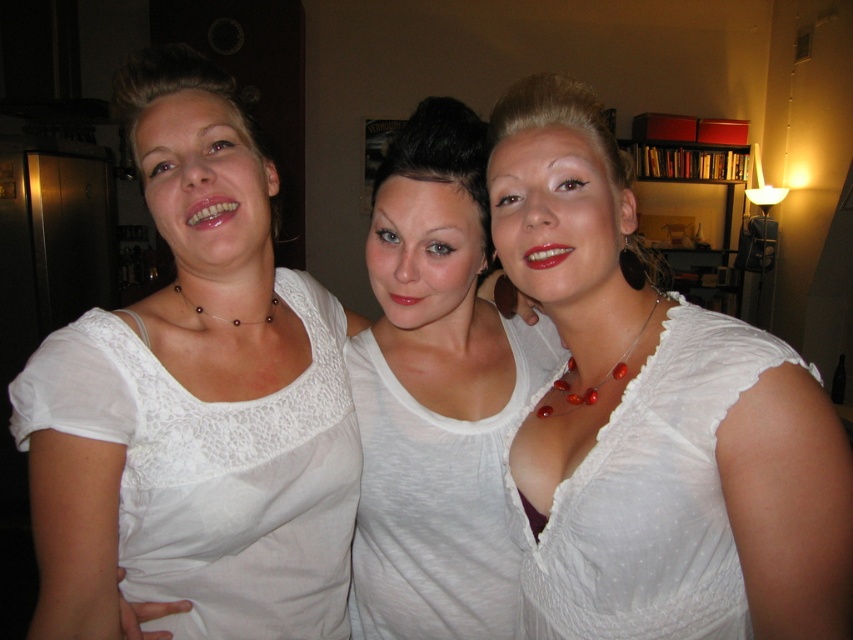
Question: Is white lace top at center positioned behind white sheer dress at center?

Choices:
 (A) yes
 (B) no

Answer: (A)

Question: Which object appears closest to the camera in this image?

Choices:
 (A) white sheer dress at center
 (B) white lace top at center
 (C) white lace blouse at left

Answer: (A)

Question: Is white lace blouse at left to the left of white sheer dress at center from the viewer's perspective?

Choices:
 (A) yes
 (B) no

Answer: (A)

Question: Which point is closer to the camera taking this photo?

Choices:
 (A) (601, 502)
 (B) (451, 202)
 (C) (192, 296)

Answer: (A)

Question: Which of the following is the closest to the observer?

Choices:
 (A) white lace blouse at left
 (B) white lace top at center

Answer: (A)

Question: Can you confirm if white lace top at center is thinner than white sheer dress at center?

Choices:
 (A) no
 (B) yes

Answer: (A)